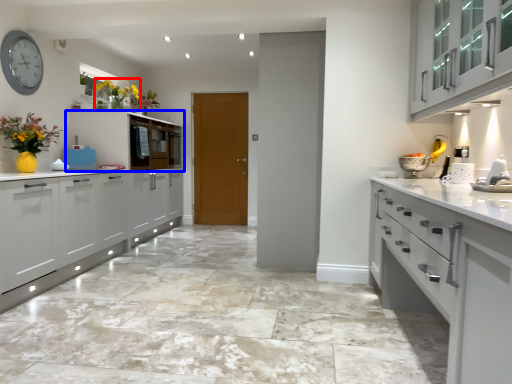
Question: Among these objects, which one is farthest to the camera, floral arrangement (highlighted by a red box) or cabinetry (highlighted by a blue box)?

Choices:
 (A) floral arrangement
 (B) cabinetry

Answer: (B)